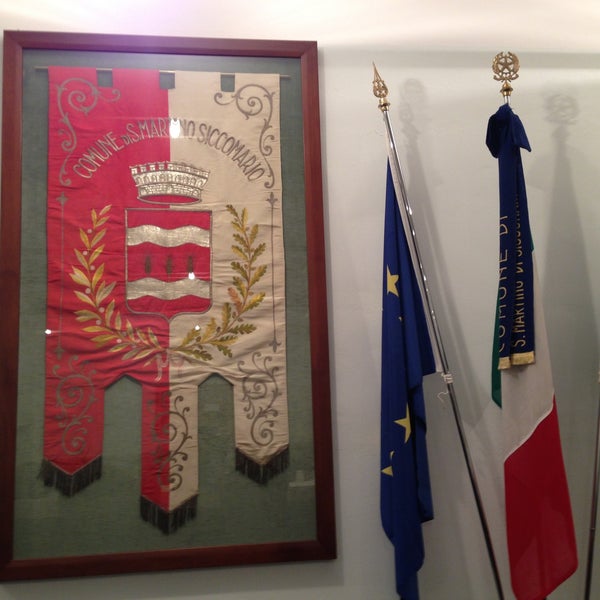
Identify the location of finial. (379, 82), (502, 62).